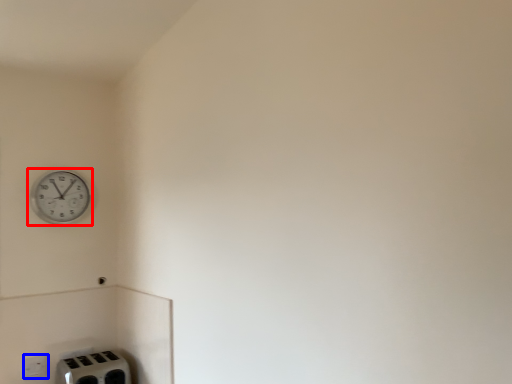
Question: Which of the following is the farthest to the observer, wall clock (highlighted by a red box) or electric outlet (highlighted by a blue box)?

Choices:
 (A) wall clock
 (B) electric outlet

Answer: (A)